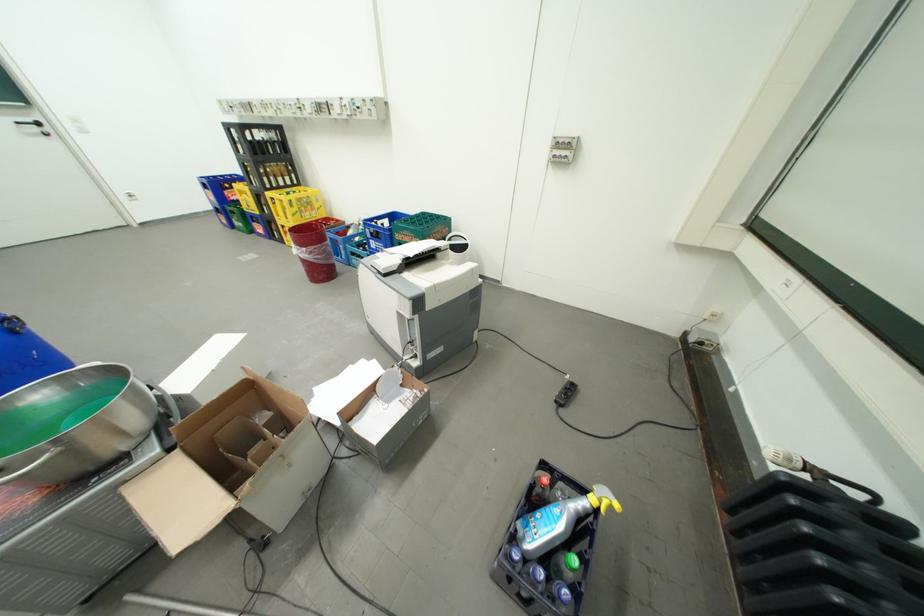
The width and height of the screenshot is (924, 616). What are the coordinates of `open cardboard box` in the screenshot? It's located at coord(384,416).